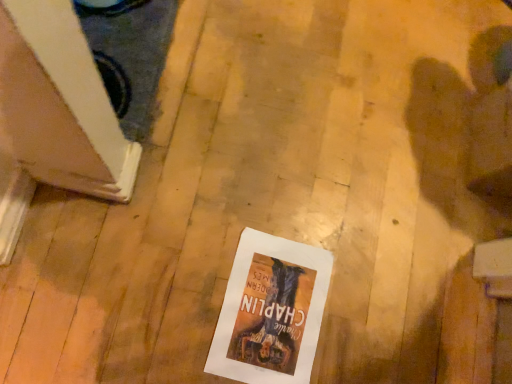
What is the approximate height of white paper poster at center?

white paper poster at center is 0.86 inches tall.

Where is `white paper poster at center`? Image resolution: width=512 pixels, height=384 pixels. white paper poster at center is located at coordinates (271, 311).

What do you see at coordinates (271, 311) in the screenshot? This screenshot has width=512, height=384. I see `white paper poster at center` at bounding box center [271, 311].

Find the location of a particular element. The image size is (512, 384). white paper poster at center is located at coordinates [271, 311].